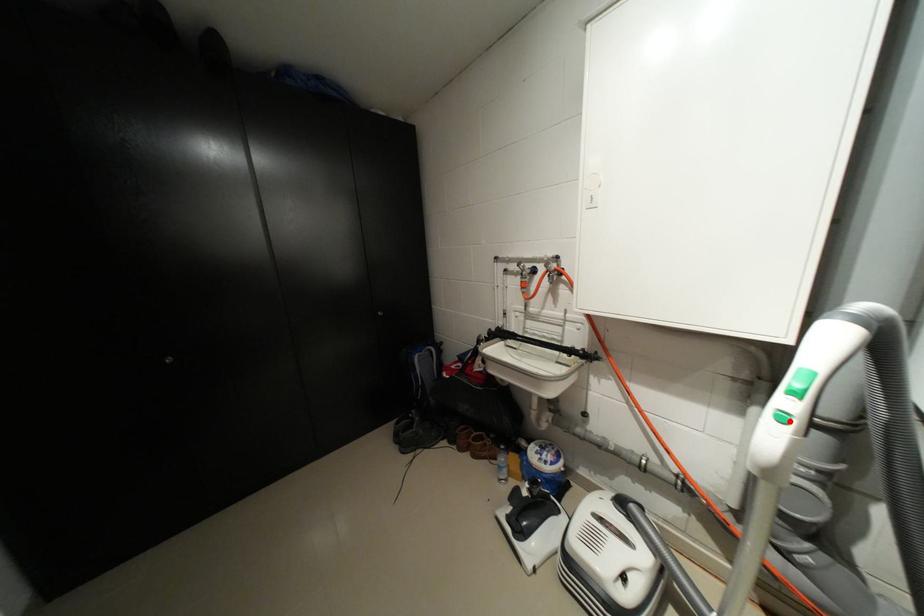
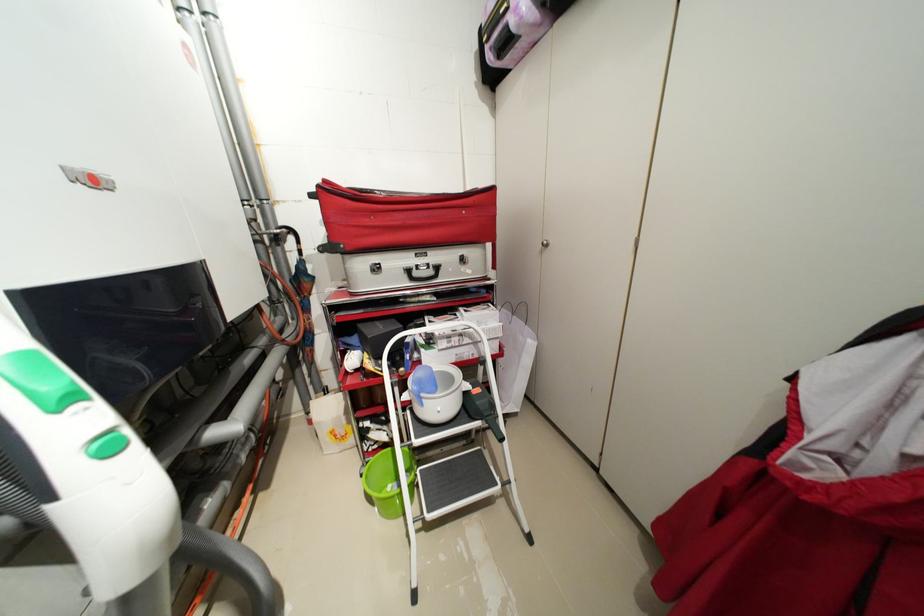
The point at the highlighted location is marked in the first image. Where is the corresponding point in the second image?

(117, 454)